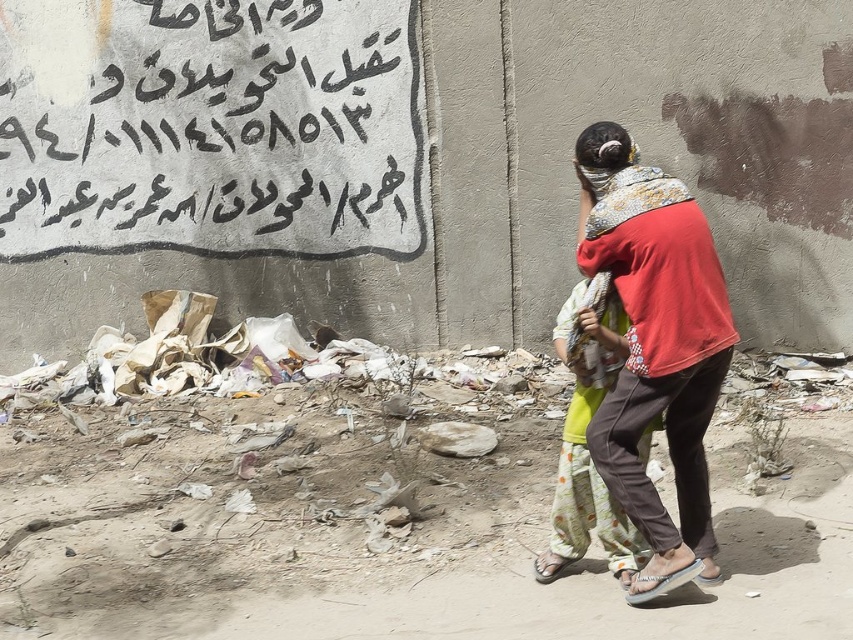
Does point (277, 244) come behind point (682, 310)?

Yes, it is.

Where is `black painted text at upper left`? The height and width of the screenshot is (640, 853). black painted text at upper left is located at coordinates coord(207,124).